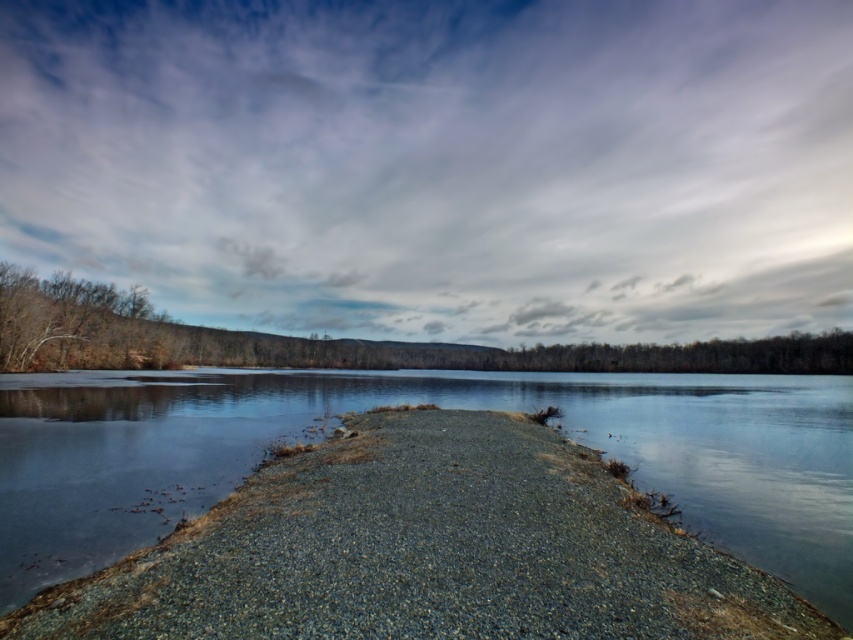
You are standing at the edge of the lake and want to walk towards the point labeled as point (200, 145). However, there is an obstacle located at point (102, 560). Based on the scene description, can you safely walk around the obstacle to reach your destination?

Point (200, 145) is further to the camera than point (102, 560), so the obstacle at point (102, 560) is closer to you. Therefore, you can safely walk around the obstacle to reach your destination as long as you navigate around the closer point (102, 560).

You are an artist planning to paint this lakeside scene. You want to ensure the cloudy sky at upper center and the clear water at center are proportionally accurate. Which of these two elements should you make wider in your painting?

The cloudy sky at upper center should be made wider in the painting since its width is larger than the clear water at center according to the description.